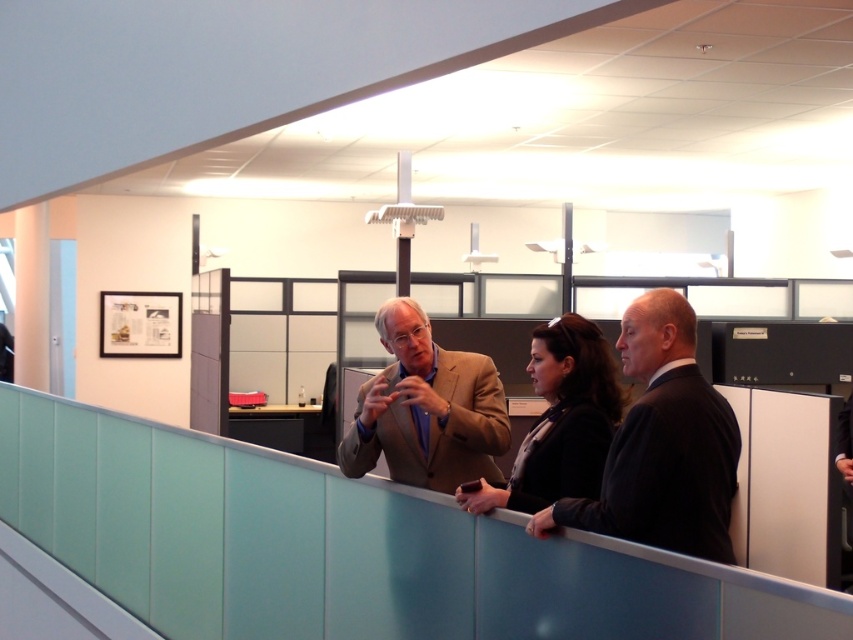
How distant is black wool suit at right from tan fabric suit at center?

The distance of black wool suit at right from tan fabric suit at center is 34.84 inches.

Which is behind, point (613, 492) or point (404, 349)?

Point (404, 349)

Does point (697, 376) come in front of point (380, 413)?

Yes.

The image size is (853, 640). What are the coordinates of `black wool suit at right` in the screenshot? It's located at pos(666,472).

Between black wool suit at right and matte black jacket at center, which one appears on the left side from the viewer's perspective?

matte black jacket at center is more to the left.

Is black wool suit at right to the right of matte black jacket at center from the viewer's perspective?

Correct, you'll find black wool suit at right to the right of matte black jacket at center.

This screenshot has width=853, height=640. What do you see at coordinates (666, 472) in the screenshot?
I see `black wool suit at right` at bounding box center [666, 472].

Image resolution: width=853 pixels, height=640 pixels. I want to click on black wool suit at right, so click(666, 472).

Who is taller, tan fabric suit at center or matte black jacket at center?

Standing taller between the two is tan fabric suit at center.

Is tan fabric suit at center positioned in front of matte black jacket at center?

No, tan fabric suit at center is further to the viewer.

Who is more distant from viewer, (425, 438) or (589, 497)?

The point (425, 438) is more distant.

The image size is (853, 640). I want to click on tan fabric suit at center, so click(426, 410).